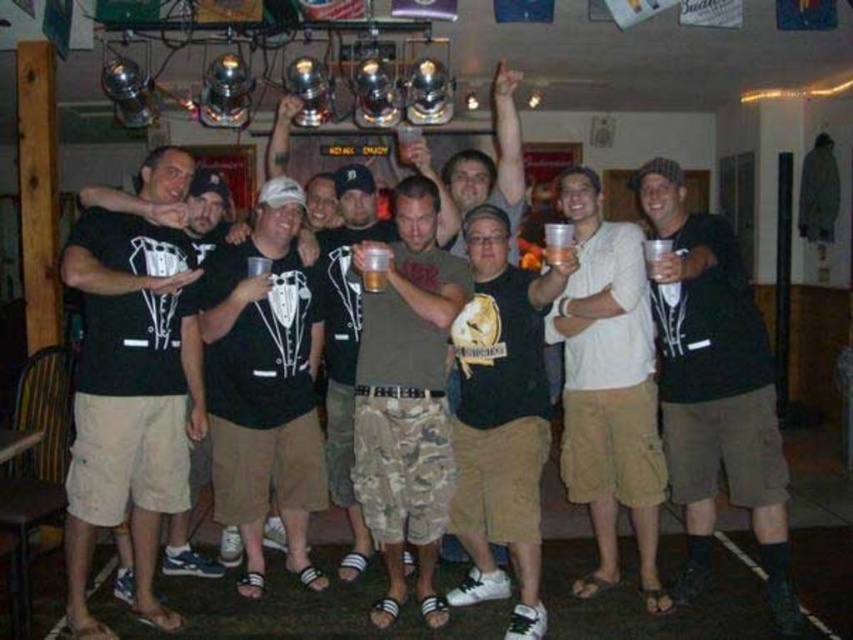
Can you confirm if black matte tuxedo shirt at center is positioned to the left of black tuxedo shirt at center?

Indeed, black matte tuxedo shirt at center is positioned on the left side of black tuxedo shirt at center.

Which is behind, point (112, 449) or point (215, 499)?

Point (215, 499)

Between point (183, 179) and point (204, 342), which one is positioned in front?

Point (183, 179) is more forward.

You are a GUI agent. You are given a task and a screenshot of the screen. Output one action in this format:
    pyautogui.click(x=<x>, y=<y>)
    Task: Click on the black matte tuxedo shirt at center
    
    Given the screenshot: What is the action you would take?
    (129, 397)

Who is taller, light beige cotton shirt at center or translucent plastic cup at center?

light beige cotton shirt at center is taller.

Does light beige cotton shirt at center have a greater height compared to translucent plastic cup at center?

Correct, light beige cotton shirt at center is much taller as translucent plastic cup at center.

Image resolution: width=853 pixels, height=640 pixels. What are the coordinates of `light beige cotton shirt at center` in the screenshot? It's located at pos(608,387).

Where is `light beige cotton shirt at center`? light beige cotton shirt at center is located at coordinates (608, 387).

Is black tuxedo shirt at center to the left of black matte t-shirt at center from the viewer's perspective?

Indeed, black tuxedo shirt at center is positioned on the left side of black matte t-shirt at center.

Is point (260, 209) less distant than point (486, 349)?

No, (260, 209) is further to viewer.

The image size is (853, 640). What are the coordinates of `black tuxedo shirt at center` in the screenshot? It's located at (264, 387).